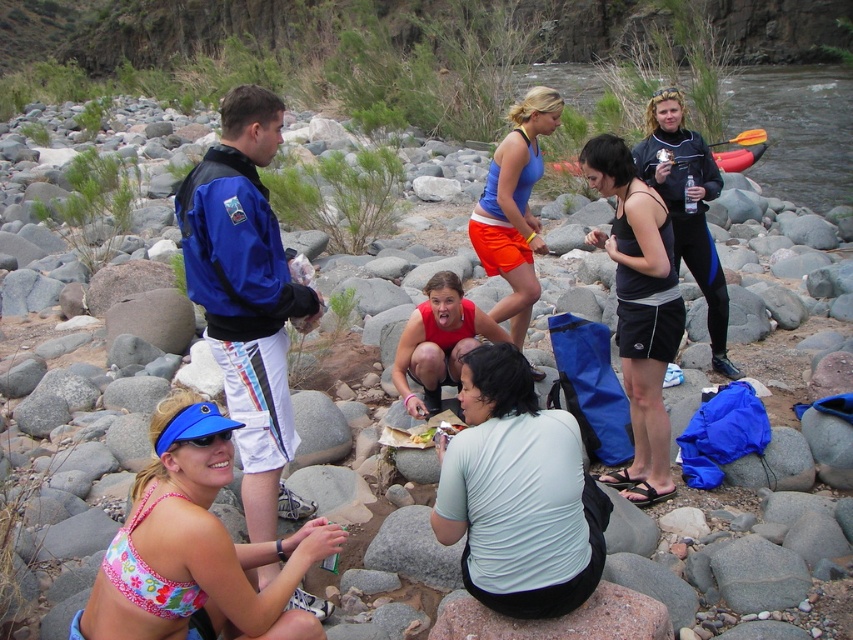
Is black matte tank top at center bigger than blue matte tank top at center?

No, black matte tank top at center is not bigger than blue matte tank top at center.

Which is in front, point (639, 234) or point (479, 209)?

Positioned in front is point (639, 234).

The width and height of the screenshot is (853, 640). What are the coordinates of `black matte tank top at center` in the screenshot? It's located at (637, 308).

Does floral fabric bikini top at lower left have a lesser height compared to black wetsuit at center?

Yes.

Which is in front, point (206, 500) or point (674, 237)?

Point (206, 500) is in front.

Locate an element on the screen. This screenshot has height=640, width=853. floral fabric bikini top at lower left is located at coordinates (195, 547).

Which of these two, floral fabric bikini top at lower left or black matte tank top at center, stands shorter?

With less height is floral fabric bikini top at lower left.

Does floral fabric bikini top at lower left come in front of black matte tank top at center?

Yes.

Does point (119, 557) lie in front of point (633, 296)?

Yes, it is in front of point (633, 296).

Locate an element on the screen. This screenshot has width=853, height=640. floral fabric bikini top at lower left is located at coordinates (195, 547).